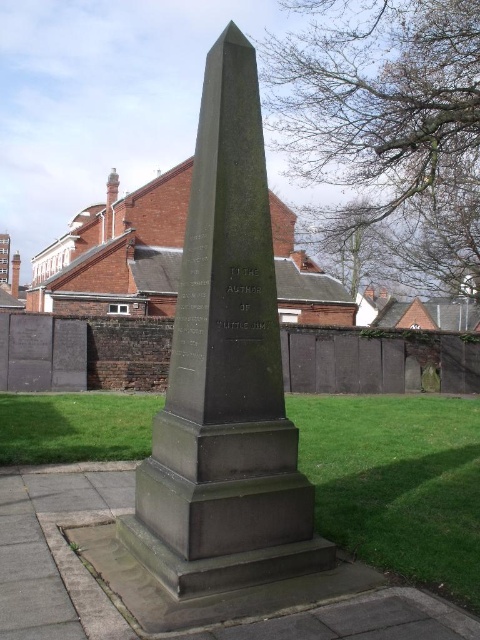
You are standing on the paved path in the cemetery and see the dark gray stone obelisk at center and the green grass at center. Which object is higher in elevation?

The dark gray stone obelisk at center is higher in elevation than the green grass at center because it is positioned above it.